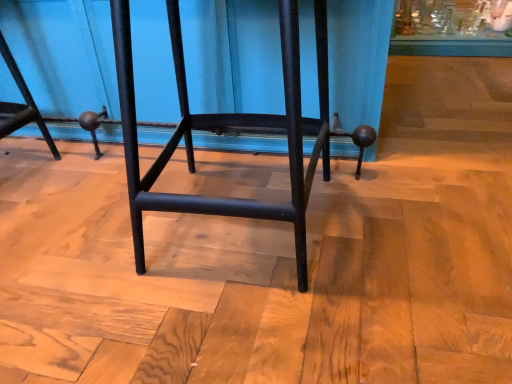
This screenshot has height=384, width=512. I want to click on free location in front of black matte metal chair at center, so click(x=250, y=328).